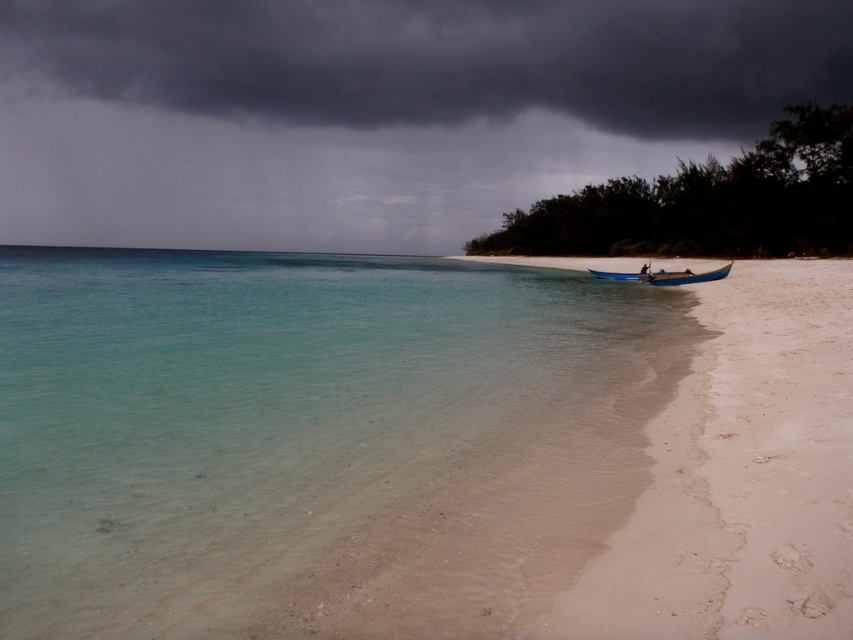
Question: Which object is farther from the camera taking this photo?

Choices:
 (A) clear water at lower right
 (B) blue polished wood boat at lower right
 (C) dark gray cloud at upper center

Answer: (C)

Question: From the image, what is the correct spatial relationship of dark gray cloud at upper center in relation to blue polished wood boat at lower right?

Choices:
 (A) left
 (B) right

Answer: (A)

Question: Estimate the real-world distances between objects in this image. Which object is farther from the blue polished wood boat at lower right?

Choices:
 (A) clear water at lower right
 (B) white sandy beach at lower right
 (C) dark gray cloud at upper center

Answer: (C)

Question: Does dark gray cloud at upper center appear under white sandy beach at lower right?

Choices:
 (A) yes
 (B) no

Answer: (B)

Question: Which of these objects is positioned closest to the clear water at lower right?

Choices:
 (A) dark gray cloud at upper center
 (B) white sandy beach at lower right

Answer: (B)

Question: Is dark gray cloud at upper center above white sandy beach at lower right?

Choices:
 (A) no
 (B) yes

Answer: (B)